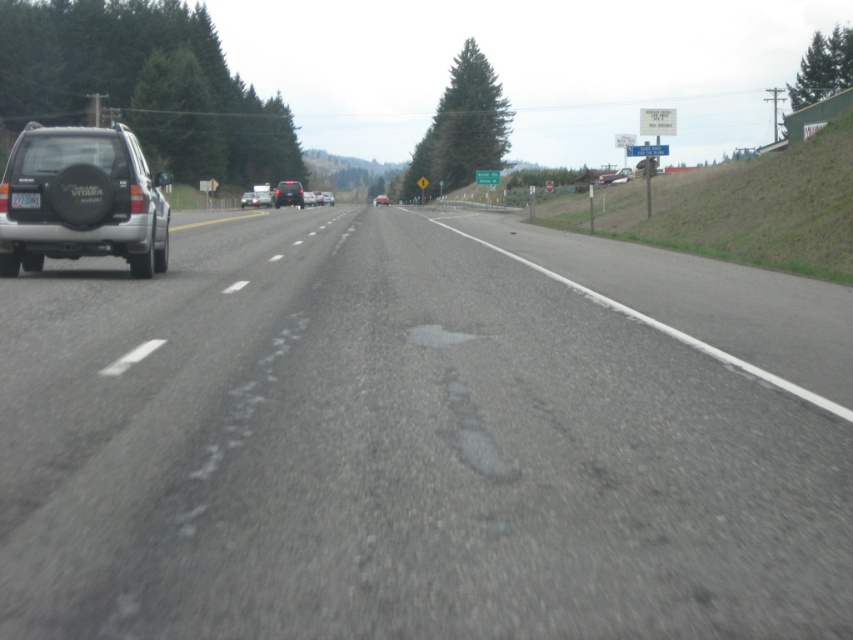
Can you confirm if silver matte suv at left is thinner than matte black car at center?

Correct, silver matte suv at left's width is less than matte black car at center's.

Measure the distance between point [33,163] and camera.

48.74 feet

Identify the location of silver matte suv at left. (82, 200).

Which is above, silver matte suv at left or silver metallic sedan at center?

silver metallic sedan at center is higher up.

Does silver matte suv at left have a lesser height compared to silver metallic sedan at center?

Yes, silver matte suv at left is shorter than silver metallic sedan at center.

Who is more distant from viewer, (160,220) or (256,198)?

The point (256,198) is behind.

The image size is (853, 640). Identify the location of silver matte suv at left. (82, 200).

Who is higher up, gray asphalt road at center or black plastic license plate at left?

Positioned higher is black plastic license plate at left.

The height and width of the screenshot is (640, 853). Identify the location of gray asphalt road at center. (419, 438).